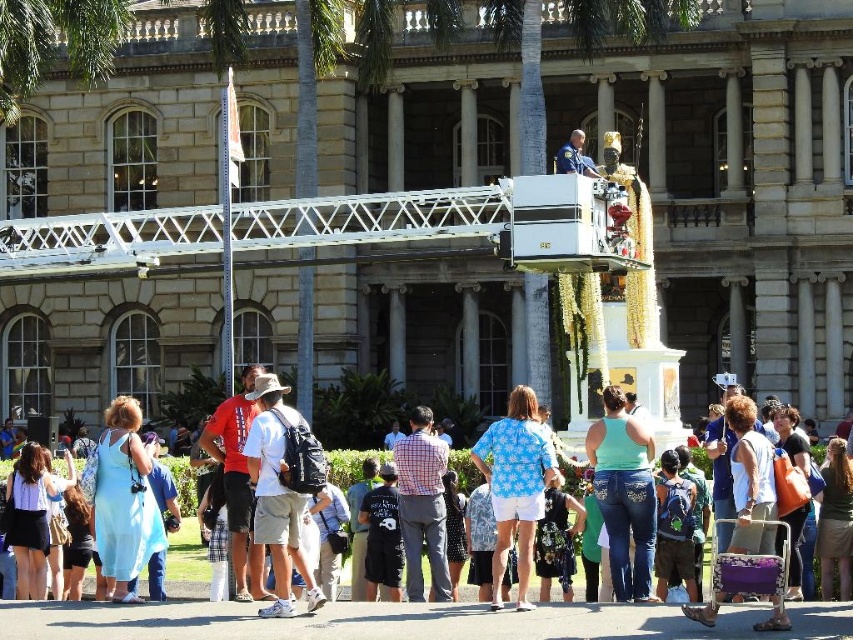
Is point (727, 122) closer to viewer compared to point (33, 515)?

That is False.

Is point (115, 273) positioned behind point (33, 548)?

Yes, it is.

Does point (490, 321) come in front of point (25, 500)?

That is False.

Image resolution: width=853 pixels, height=640 pixels. I want to click on gray stone building at center, so coord(550,170).

Describe the element at coordinates (32, 515) in the screenshot. The height and width of the screenshot is (640, 853). I see `light blue denim skirt at lower left` at that location.

Is light blue denim skirt at lower left thinner than black printed dress at center?

No, light blue denim skirt at lower left is not thinner than black printed dress at center.

Who is more distant from viewer, [16,532] or [456,556]?

Positioned behind is point [456,556].

At what (x,y) coordinates should I click in order to perform the action: click on light blue denim skirt at lower left. Please return your answer as a coordinate pair (x, y). The image size is (853, 640). Looking at the image, I should click on (32, 515).

From the picture: Is brown fabric skirt at lower right to the left of black printed dress at center from the viewer's perspective?

In fact, brown fabric skirt at lower right is to the right of black printed dress at center.

Does brown fabric skirt at lower right have a lesser height compared to black printed dress at center?

Indeed, brown fabric skirt at lower right has a lesser height compared to black printed dress at center.

Describe the element at coordinates (834, 522) in the screenshot. I see `brown fabric skirt at lower right` at that location.

This screenshot has width=853, height=640. Find the location of `brown fabric skirt at lower right`. brown fabric skirt at lower right is located at coordinates (834, 522).